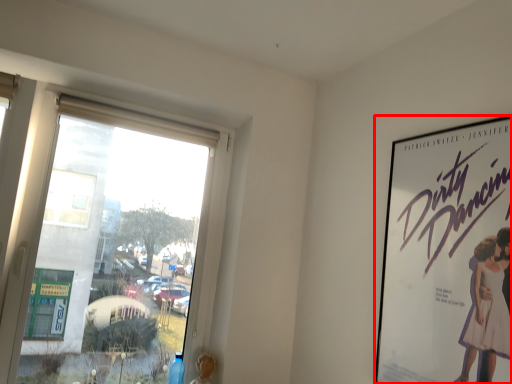
Question: In this image, where is poster (annotated by the red box) located relative to window?

Choices:
 (A) right
 (B) left

Answer: (A)